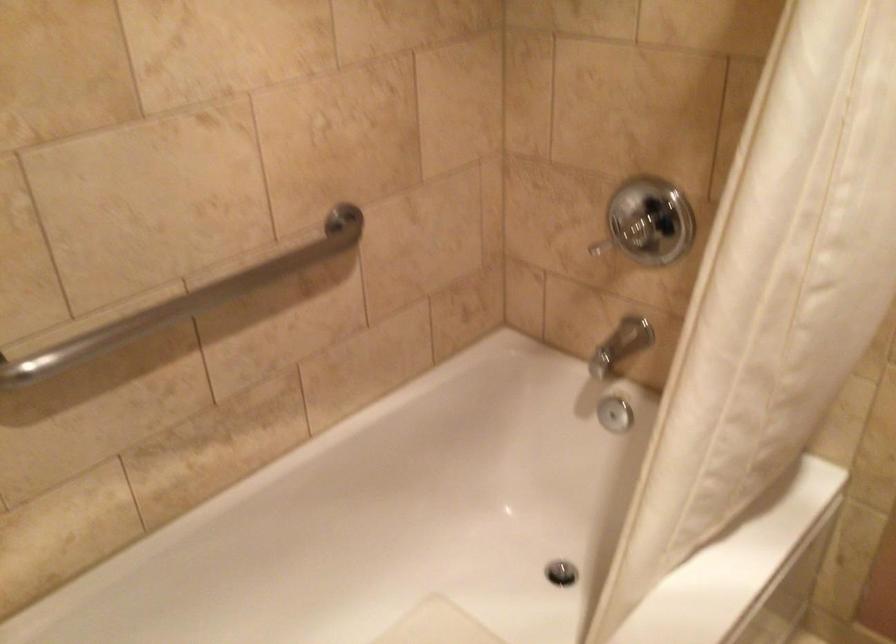
Describe the element at coordinates (185, 301) in the screenshot. I see `the silver grab bar` at that location.